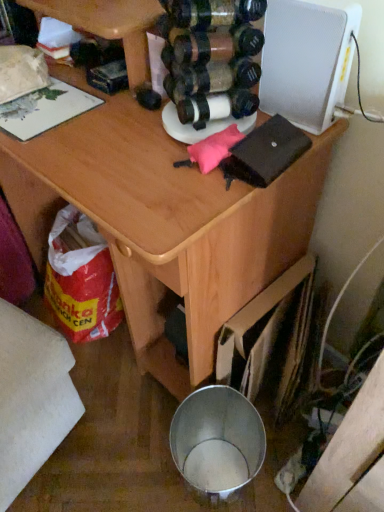
Question: Is wooden desk at center at the left side of white textured speaker at upper right?

Choices:
 (A) no
 (B) yes

Answer: (B)

Question: Is white textured speaker at upper right located within wooden desk at center?

Choices:
 (A) yes
 (B) no

Answer: (A)

Question: From a real-world perspective, is wooden desk at center on white textured speaker at upper right?

Choices:
 (A) yes
 (B) no

Answer: (B)

Question: Does wooden desk at center have a greater width compared to white textured speaker at upper right?

Choices:
 (A) yes
 (B) no

Answer: (A)

Question: From the image's perspective, is wooden desk at center located beneath white textured speaker at upper right?

Choices:
 (A) no
 (B) yes

Answer: (B)

Question: Can you confirm if wooden desk at center is thinner than white textured speaker at upper right?

Choices:
 (A) no
 (B) yes

Answer: (A)

Question: From the image's perspective, is white textured speaker at upper right on top of wooden desk at center?

Choices:
 (A) yes
 (B) no

Answer: (A)

Question: Does white textured speaker at upper right contain wooden desk at center?

Choices:
 (A) no
 (B) yes

Answer: (A)

Question: Can you confirm if white textured speaker at upper right is positioned to the right of wooden desk at center?

Choices:
 (A) no
 (B) yes

Answer: (B)

Question: From a real-world perspective, is white textured speaker at upper right physically below wooden desk at center?

Choices:
 (A) no
 (B) yes

Answer: (A)

Question: Does white textured speaker at upper right have a lesser height compared to wooden desk at center?

Choices:
 (A) yes
 (B) no

Answer: (A)

Question: Is white textured speaker at upper right wider than wooden desk at center?

Choices:
 (A) no
 (B) yes

Answer: (A)

Question: Based on their positions, is wooden desk at center located to the left or right of white textured speaker at upper right?

Choices:
 (A) right
 (B) left

Answer: (B)